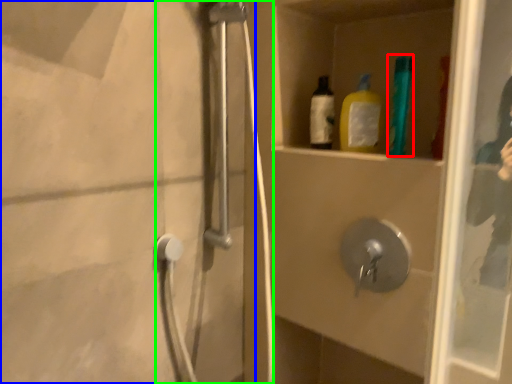
Question: Which is nearer to the bottle (highlighted by a red box)? screen door (highlighted by a blue box) or shower door (highlighted by a green box).

Choices:
 (A) screen door
 (B) shower door

Answer: (B)